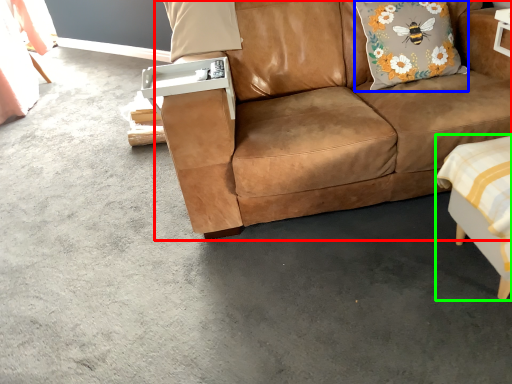
Question: Considering the real-world distances, which object is farthest from studio couch (highlighted by a red box)? pillow (highlighted by a blue box) or swivel chair (highlighted by a green box)?

Choices:
 (A) pillow
 (B) swivel chair

Answer: (B)